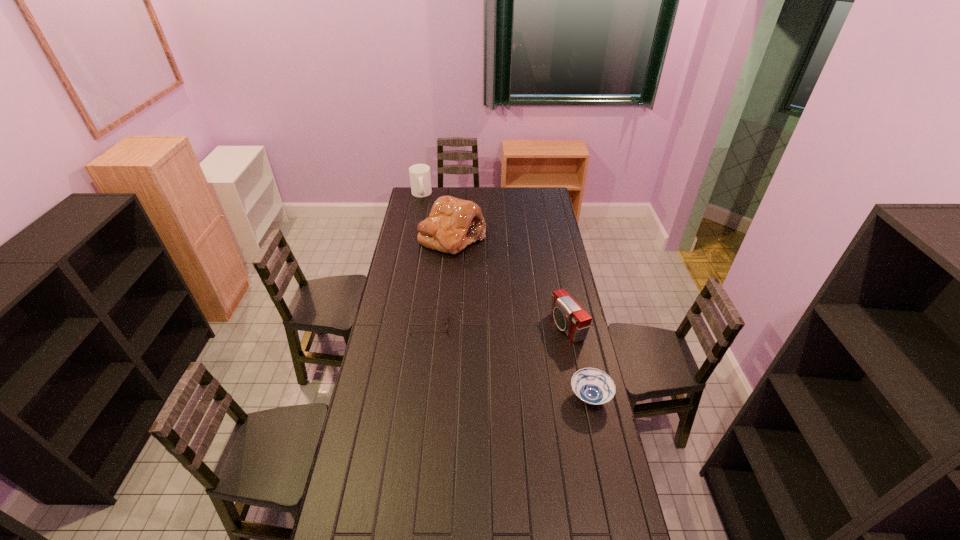
Locate an element on the screen. Image resolution: width=960 pixels, height=540 pixels. the shortest object is located at coordinates (416, 308).

Locate an element on the screen. The image size is (960, 540). soup bowl is located at coordinates (593, 386).

The image size is (960, 540). What are the coordinates of `the fourth tallest object` in the screenshot? It's located at (593, 386).

The width and height of the screenshot is (960, 540). Find the location of `bread`. bread is located at coordinates (453, 223).

I want to click on the second farthest object, so click(x=453, y=223).

At what (x,y) coordinates should I click in order to perform the action: click on the farthest object. Please return your answer as a coordinate pair (x, y). Image resolution: width=960 pixels, height=540 pixels. Looking at the image, I should click on (420, 179).

Locate an element on the screen. camera is located at coordinates (570, 317).

The image size is (960, 540). Identify the location of vacant space located on the front-facing side of the shortest object. (496, 326).

Find the location of a particular element. Image resolution: width=960 pixels, height=540 pixels. free region located 0.360m on the left of the nearest object is located at coordinates (477, 397).

Identify the location of free location located on the filling side of the second farthest object. (480, 299).